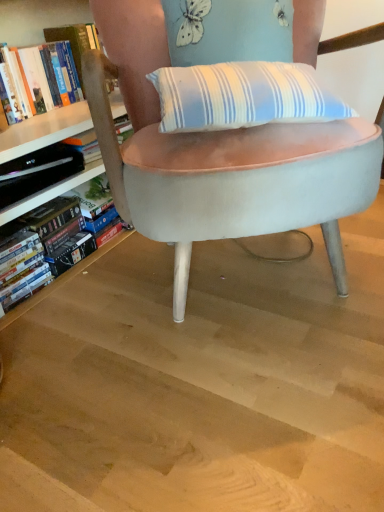
Question: In the image, is hardcover book at left positioned in front of or behind hardcover book at left, the 1th book positioned from the bottom?

Choices:
 (A) behind
 (B) front

Answer: (B)

Question: Is point (56, 176) closer or farther from the camera than point (64, 239)?

Choices:
 (A) closer
 (B) farther

Answer: (A)

Question: Which is nearer to the hardcover book at left, which is the 1th book in top-to-bottom order?

Choices:
 (A) velvet light blue chair at center
 (B) light brown wood at center
 (C) hardcover book at left, the 2th book from the top
 (D) hardcover book at left

Answer: (D)

Question: Which is farther from the velvet light blue chair at center?

Choices:
 (A) hardcover book at left, the 2th book from the top
 (B) hardcover book at left, which is the 1th book in top-to-bottom order
 (C) hardcover book at left
 (D) light brown wood at center

Answer: (B)